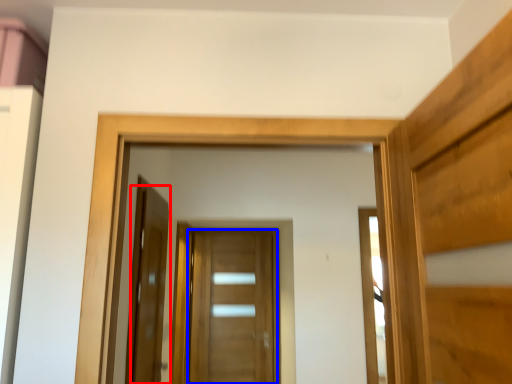
Question: Which point is further to the camera, door (highlighted by a red box) or door (highlighted by a blue box)?

Choices:
 (A) door
 (B) door

Answer: (B)